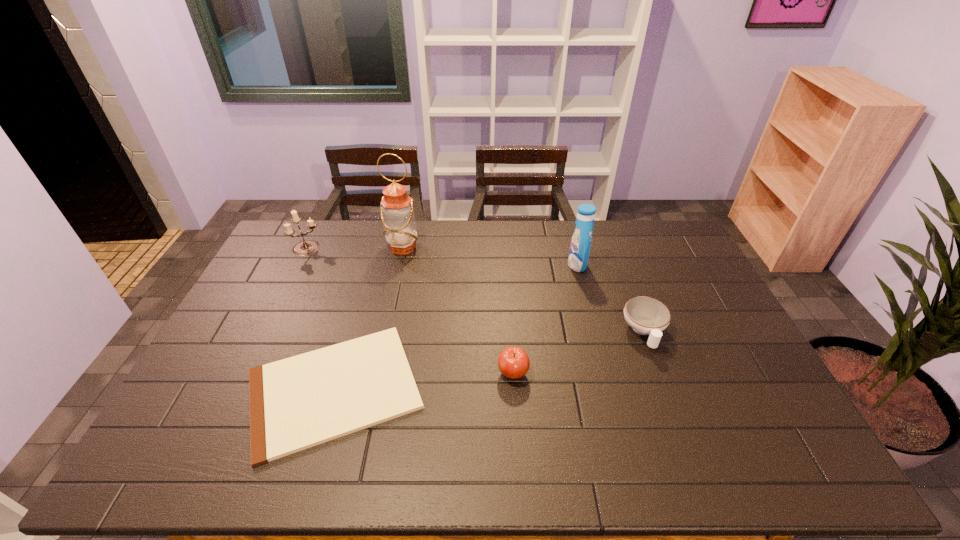
Image resolution: width=960 pixels, height=540 pixels. Identify the location of object located in the near edge section of the desktop. (296, 403).

Where is `candle holder at the left edge`? This screenshot has width=960, height=540. candle holder at the left edge is located at coordinates (305, 247).

Identify the location of clipboard that is positioned at the left edge. (296, 403).

Find the location of a particular element. object that is at the far left corner is located at coordinates (305, 247).

Locate an element on the screen. The height and width of the screenshot is (540, 960). object present at the near left corner is located at coordinates (296, 403).

In the image, there is a desktop. Find the location of `free space at the far edge`. free space at the far edge is located at coordinates (366, 251).

Identify the location of vacant space at the near edge of the desktop. (348, 472).

Locate an element on the screen. This screenshot has width=960, height=540. free space at the left edge is located at coordinates tap(233, 363).

Where is `vacant area at the right edge of the desktop`? vacant area at the right edge of the desktop is located at coordinates (691, 335).

Find the location of a particular element. The image size is (960, 540). free space at the near left corner of the desktop is located at coordinates (193, 451).